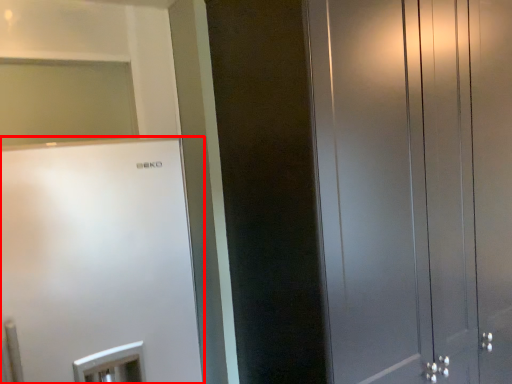
Question: Considering the relative positions of refrigerator (annotated by the red box) and door in the image provided, where is refrigerator (annotated by the red box) located with respect to the staircase?

Choices:
 (A) right
 (B) left

Answer: (B)